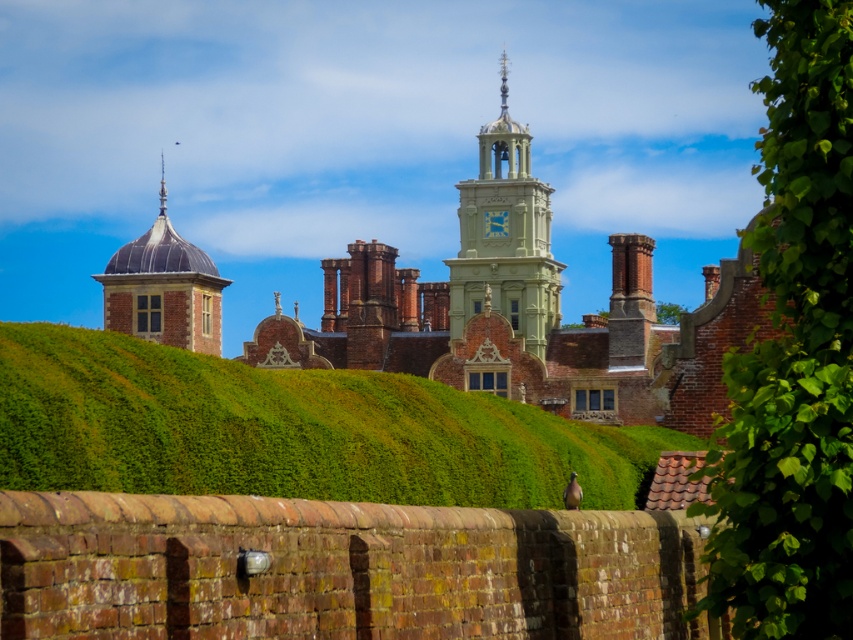
Question: Does green stone clock tower at center have a greater width compared to smooth gray dome at upper left?

Choices:
 (A) yes
 (B) no

Answer: (B)

Question: Which of the following is the farthest from the observer?

Choices:
 (A) green leafy hedge at right
 (B) green hedge at center
 (C) green stone clock tower at center
 (D) smooth gray dome at upper left

Answer: (D)

Question: Is green hedge at center positioned before green stone clock tower at center?

Choices:
 (A) no
 (B) yes

Answer: (B)

Question: Which point is farther to the camera?

Choices:
 (A) (79, 456)
 (B) (508, 221)
 (C) (849, 600)

Answer: (B)

Question: Does green leafy hedge at right appear over green stone clock tower at center?

Choices:
 (A) no
 (B) yes

Answer: (B)

Question: Which point is closer to the camera taking this photo?

Choices:
 (A) (822, 58)
 (B) (474, 259)
 (C) (578, 470)

Answer: (A)